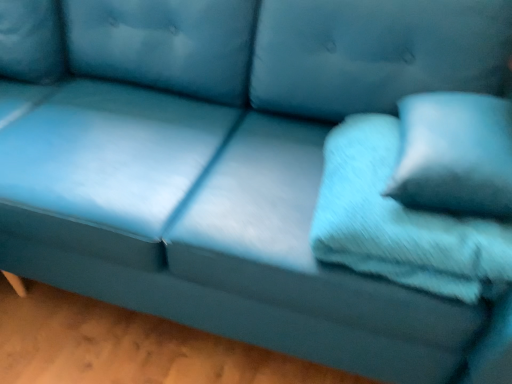
Where is `soft blue fabric pillow at right, the 1th pillow viewed from the right`? This screenshot has width=512, height=384. soft blue fabric pillow at right, the 1th pillow viewed from the right is located at coordinates (455, 154).

This screenshot has height=384, width=512. What do you see at coordinates (455, 154) in the screenshot?
I see `soft blue fabric pillow at right, the 1th pillow viewed from the right` at bounding box center [455, 154].

What do you see at coordinates (400, 222) in the screenshot? The image size is (512, 384). I see `soft blue fabric pillow at right, acting as the 2th pillow starting from the right` at bounding box center [400, 222].

Where is `soft blue fabric pillow at right, acting as the 2th pillow starting from the right`? The width and height of the screenshot is (512, 384). soft blue fabric pillow at right, acting as the 2th pillow starting from the right is located at coordinates (400, 222).

Find the location of a particular element. The image size is (512, 384). soft blue fabric pillow at right, which is the second pillow in left-to-right order is located at coordinates (455, 154).

Between soft blue fabric pillow at right, acting as the 2th pillow starting from the right, and soft blue fabric pillow at right, the 1th pillow viewed from the right, which one appears on the left side from the viewer's perspective?

soft blue fabric pillow at right, acting as the 2th pillow starting from the right, is more to the left.

Considering their positions, is soft blue fabric pillow at right, acting as the 2th pillow starting from the right, located in front of or behind soft blue fabric pillow at right, which is the second pillow in left-to-right order?

soft blue fabric pillow at right, acting as the 2th pillow starting from the right, is positioned farther from the viewer than soft blue fabric pillow at right, which is the second pillow in left-to-right order.

Which is closer to the camera, (489, 222) or (430, 146)?

Point (489, 222).

From the image's perspective, is soft blue fabric pillow at right, acting as the 2th pillow starting from the right, above or below soft blue fabric pillow at right, the 1th pillow viewed from the right?

From the image's perspective, soft blue fabric pillow at right, acting as the 2th pillow starting from the right, appears below soft blue fabric pillow at right, the 1th pillow viewed from the right.

Based on the photo, from a real-world perspective, is soft blue fabric pillow at right, acting as the 2th pillow starting from the right, located higher than soft blue fabric pillow at right, the 1th pillow viewed from the right?

No, from a real-world perspective, soft blue fabric pillow at right, acting as the 2th pillow starting from the right, is not above soft blue fabric pillow at right, the 1th pillow viewed from the right.

Is soft blue fabric pillow at right, acting as the 2th pillow starting from the right, thinner than soft blue fabric pillow at right, which is the second pillow in left-to-right order?

In fact, soft blue fabric pillow at right, acting as the 2th pillow starting from the right, might be wider than soft blue fabric pillow at right, which is the second pillow in left-to-right order.

Which of these two, soft blue fabric pillow at right, the 1th pillow viewed from the left, or soft blue fabric pillow at right, the 1th pillow viewed from the right, stands shorter?

soft blue fabric pillow at right, the 1th pillow viewed from the left, is shorter.

Considering the sizes of soft blue fabric pillow at right, acting as the 2th pillow starting from the right, and soft blue fabric pillow at right, which is the second pillow in left-to-right order, in the image, is soft blue fabric pillow at right, acting as the 2th pillow starting from the right, bigger or smaller than soft blue fabric pillow at right, which is the second pillow in left-to-right order,?

Clearly, soft blue fabric pillow at right, acting as the 2th pillow starting from the right, is larger in size than soft blue fabric pillow at right, which is the second pillow in left-to-right order.

Is soft blue fabric pillow at right, the 1th pillow viewed from the left, not inside soft blue fabric pillow at right, the 1th pillow viewed from the right?

soft blue fabric pillow at right, the 1th pillow viewed from the left, lies outside soft blue fabric pillow at right, the 1th pillow viewed from the right,'s area.

Is soft blue fabric pillow at right, acting as the 2th pillow starting from the right, with soft blue fabric pillow at right, which is the second pillow in left-to-right order?

No, soft blue fabric pillow at right, acting as the 2th pillow starting from the right, is not touching soft blue fabric pillow at right, which is the second pillow in left-to-right order.

Is soft blue fabric pillow at right, acting as the 2th pillow starting from the right, oriented away from soft blue fabric pillow at right, which is the second pillow in left-to-right order?

No, soft blue fabric pillow at right, acting as the 2th pillow starting from the right, is not facing away from soft blue fabric pillow at right, which is the second pillow in left-to-right order.

Measure the distance between soft blue fabric pillow at right, the 1th pillow viewed from the left, and soft blue fabric pillow at right, which is the second pillow in left-to-right order.

They are 4.08 inches apart.

Identify the location of pillow that is above the soft blue fabric pillow at right, the 1th pillow viewed from the left (from the image's perspective). (455, 154).

Which is more to the right, soft blue fabric pillow at right, which is the second pillow in left-to-right order, or soft blue fabric pillow at right, acting as the 2th pillow starting from the right?

From the viewer's perspective, soft blue fabric pillow at right, which is the second pillow in left-to-right order, appears more on the right side.

Does soft blue fabric pillow at right, which is the second pillow in left-to-right order, come behind soft blue fabric pillow at right, acting as the 2th pillow starting from the right?

No.

Is point (510, 186) positioned before point (422, 222)?

Yes, it is in front of point (422, 222).

Consider the image. From the image's perspective, is soft blue fabric pillow at right, the 1th pillow viewed from the right, above or below soft blue fabric pillow at right, the 1th pillow viewed from the left?

Based on their image positions, soft blue fabric pillow at right, the 1th pillow viewed from the right, is located above soft blue fabric pillow at right, the 1th pillow viewed from the left.

From a real-world perspective, is soft blue fabric pillow at right, the 1th pillow viewed from the right, over soft blue fabric pillow at right, the 1th pillow viewed from the left?

Indeed, from a real-world perspective, soft blue fabric pillow at right, the 1th pillow viewed from the right, stands above soft blue fabric pillow at right, the 1th pillow viewed from the left.

Considering the sizes of objects soft blue fabric pillow at right, which is the second pillow in left-to-right order, and soft blue fabric pillow at right, acting as the 2th pillow starting from the right, in the image provided, who is wider, soft blue fabric pillow at right, which is the second pillow in left-to-right order, or soft blue fabric pillow at right, acting as the 2th pillow starting from the right,?

soft blue fabric pillow at right, acting as the 2th pillow starting from the right.

Is soft blue fabric pillow at right, the 1th pillow viewed from the right, shorter than soft blue fabric pillow at right, the 1th pillow viewed from the left?

No.

Is soft blue fabric pillow at right, which is the second pillow in left-to-right order, smaller than soft blue fabric pillow at right, the 1th pillow viewed from the left?

Yes, soft blue fabric pillow at right, which is the second pillow in left-to-right order, is smaller than soft blue fabric pillow at right, the 1th pillow viewed from the left.

Is soft blue fabric pillow at right, the 1th pillow viewed from the right, completely or partially outside of soft blue fabric pillow at right, acting as the 2th pillow starting from the right?

Yes.

Is soft blue fabric pillow at right, which is the second pillow in left-to-right order, not near soft blue fabric pillow at right, acting as the 2th pillow starting from the right?

No.

Could you tell me if soft blue fabric pillow at right, the 1th pillow viewed from the right, is turned towards soft blue fabric pillow at right, the 1th pillow viewed from the left?

No, soft blue fabric pillow at right, the 1th pillow viewed from the right, is not turned towards soft blue fabric pillow at right, the 1th pillow viewed from the left.

Can you tell me how much soft blue fabric pillow at right, the 1th pillow viewed from the right, and soft blue fabric pillow at right, the 1th pillow viewed from the left, differ in facing direction?

There is a 0.000468-degree angle between the facing directions of soft blue fabric pillow at right, the 1th pillow viewed from the right, and soft blue fabric pillow at right, the 1th pillow viewed from the left.

Consider the image. How much distance is there between soft blue fabric pillow at right, which is the second pillow in left-to-right order, and soft blue fabric pillow at right, the 1th pillow viewed from the left?

They are 10.36 centimeters apart.

I want to click on pillow above the soft blue fabric pillow at right, the 1th pillow viewed from the left (from the image's perspective), so click(x=455, y=154).

This screenshot has width=512, height=384. Identify the location of pillow that is below the soft blue fabric pillow at right, the 1th pillow viewed from the right (from the image's perspective). (400, 222).

Locate an element on the screen. pillow on the right of soft blue fabric pillow at right, acting as the 2th pillow starting from the right is located at coordinates (455, 154).